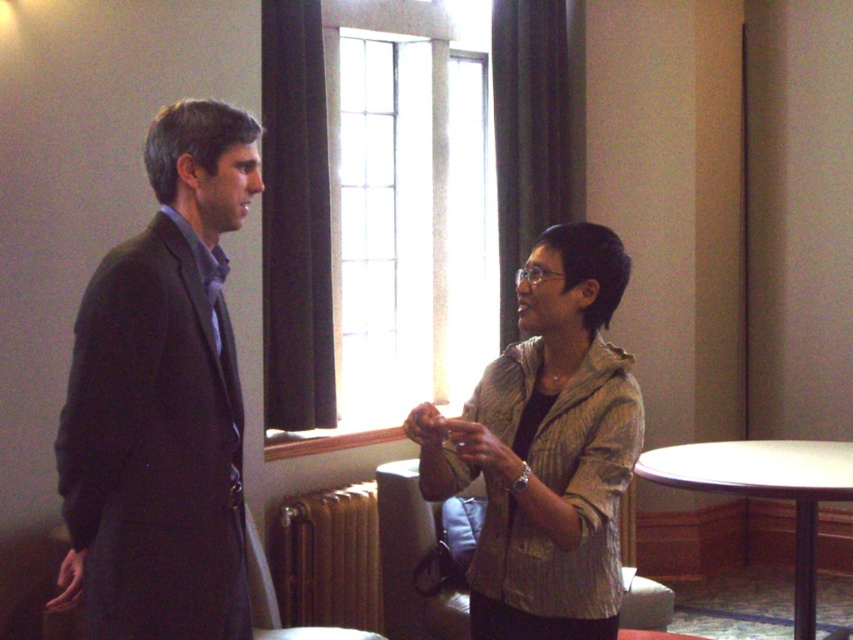
Question: Which point is farther to the camera?

Choices:
 (A) (757, 442)
 (B) (299, 611)
 (C) (178, 502)

Answer: (A)

Question: Is textured beige jacket at center to the left of gold metallic radiator at lower center from the viewer's perspective?

Choices:
 (A) yes
 (B) no

Answer: (B)

Question: Is textured beige jacket at center positioned behind white wood table at lower right?

Choices:
 (A) no
 (B) yes

Answer: (A)

Question: Which point is farther to the camera?

Choices:
 (A) (606, 433)
 (B) (328, 532)
 (C) (772, 492)
 (D) (242, 132)

Answer: (B)

Question: Which of these objects is positioned farthest from the gold metallic radiator at lower center?

Choices:
 (A) dark gray suit at left
 (B) textured beige jacket at center

Answer: (A)

Question: Is dark gray suit at left below white wood table at lower right?

Choices:
 (A) no
 (B) yes

Answer: (A)